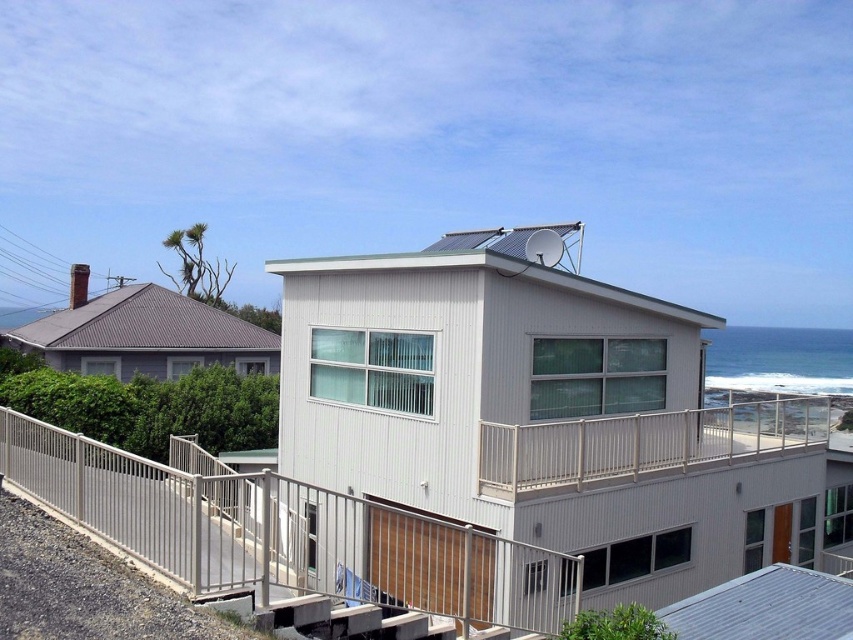
Is metallic silver railing at lower center wider than satin silver railing at upper center?

Incorrect, metallic silver railing at lower center's width does not surpass satin silver railing at upper center's.

Does point (248, 477) lie behind point (680, 465)?

That is False.

Find the location of `metallic silver railing at lower center`. metallic silver railing at lower center is located at coordinates (288, 534).